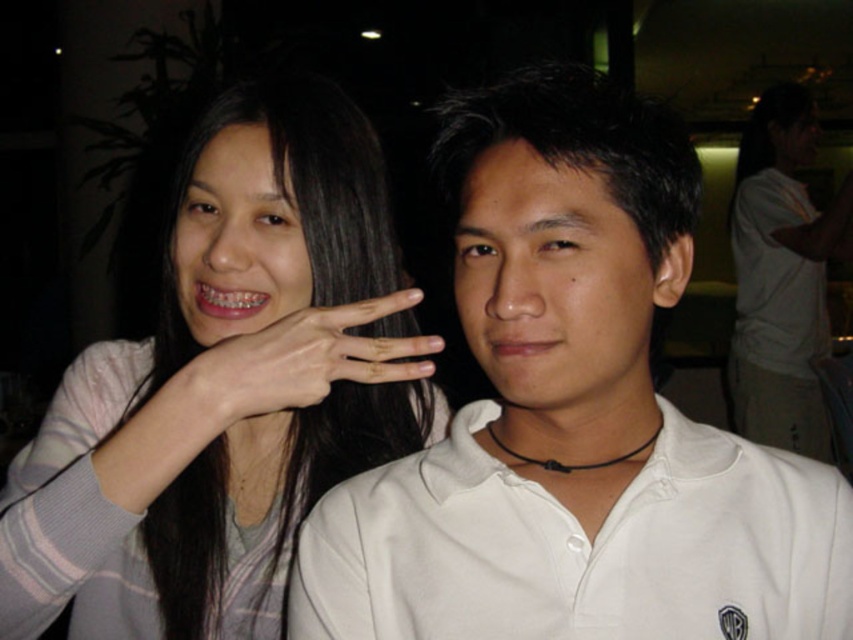
Question: Among these points, which one is nearest to the camera?

Choices:
 (A) (502, 400)
 (B) (544, 588)

Answer: (B)

Question: Considering the real-world distances, which object is farthest from the white matte shirt at upper right?

Choices:
 (A) pink striped sweater at upper left
 (B) white matte shirt at center
 (C) white cotton shirt at center
 (D) light skin tone finger at center

Answer: (C)

Question: Does white cotton shirt at center appear on the right side of white matte shirt at upper right?

Choices:
 (A) yes
 (B) no

Answer: (B)

Question: Observing the image, what is the correct spatial positioning of white cotton shirt at center in reference to white matte shirt at upper right?

Choices:
 (A) below
 (B) above

Answer: (A)

Question: From the image, what is the correct spatial relationship of white matte shirt at center in relation to light skin tone finger at center?

Choices:
 (A) below
 (B) above

Answer: (A)

Question: Which point appears farthest from the camera in this image?

Choices:
 (A) 563,161
 (B) 300,228
 (C) 814,136

Answer: (C)